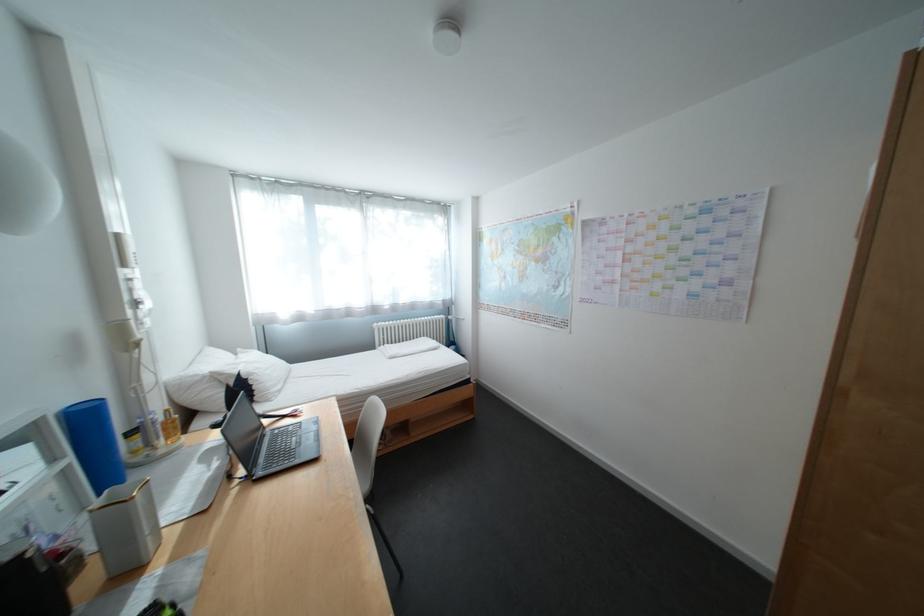
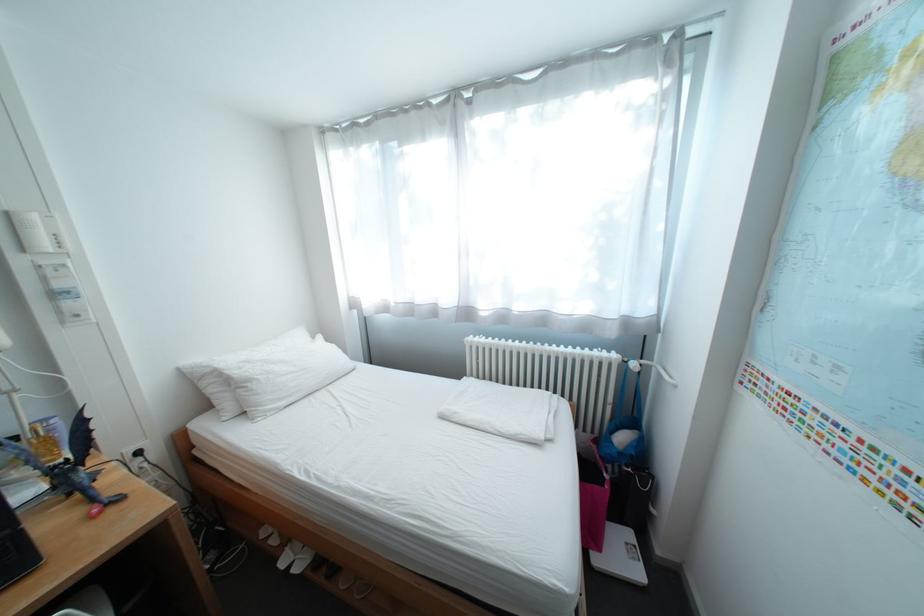
Locate, in the second image, the point that corresponds to point 458,318 in the first image.

(637, 362)